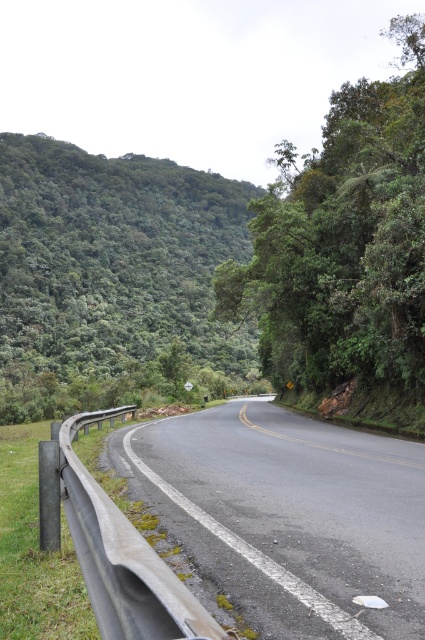
You are driving a truck that is 4 meters tall. You see the gray metallic guardrail at left and the green leafy tree at upper right in your path. Will your truck clear the height of the tallest object in your path?

The gray metallic guardrail at left is shorter than the green leafy tree at upper right. Since the truck is 4 meters tall, it will clear the height of the tallest object, which is the green leafy tree at upper right, only if the tree is shorter than 4 meters. However, the exact height of the tree isn

You are driving along the road and need to park your car. You see a green leafy tree at left and a gray metallic guardrail at left. Which object is closer to the road?

The green leafy tree at left is positioned on the left side of the gray metallic guardrail at left, meaning the guardrail is closer to the road than the tree.